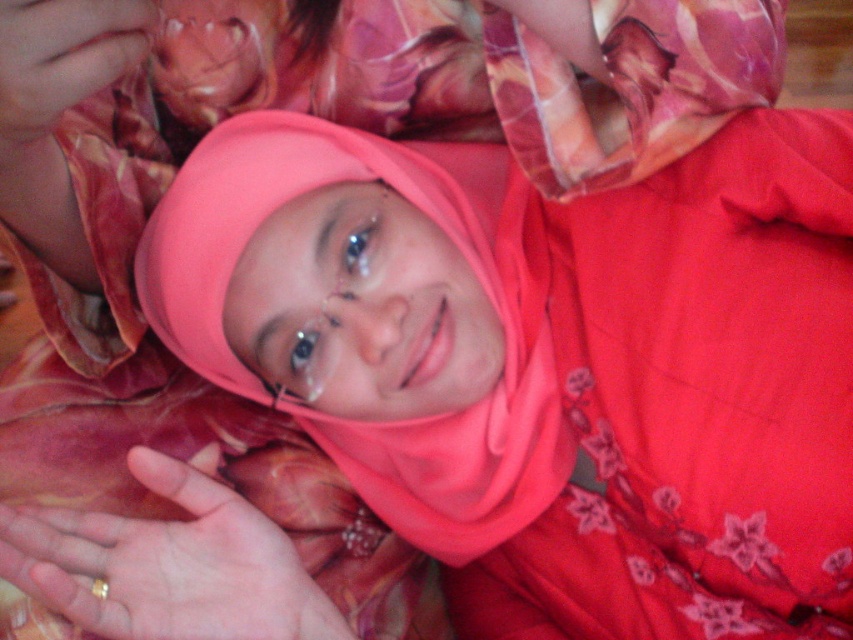
What do you see at coordinates (627, 83) in the screenshot? The height and width of the screenshot is (640, 853). I see `pink floral scarf at upper center` at bounding box center [627, 83].

Who is taller, pink floral scarf at upper center or pink fabric at upper left?

Standing taller between the two is pink floral scarf at upper center.

Is point (598, 102) in front of point (138, 33)?

No, it is not.

Find the location of a particular element. pink floral scarf at upper center is located at coordinates (627, 83).

Is matte pink hijab at center thinner than pink floral scarf at upper center?

Incorrect, matte pink hijab at center's width is not less than pink floral scarf at upper center's.

Which is behind, point (550, 481) or point (752, 12)?

Positioned behind is point (550, 481).

Identify the location of matte pink hijab at center. (378, 422).

Which of these two, gold metallic ring at lower left or pink fabric at upper left, stands taller?

With more height is pink fabric at upper left.

Locate an element on the screen. This screenshot has height=640, width=853. gold metallic ring at lower left is located at coordinates (167, 564).